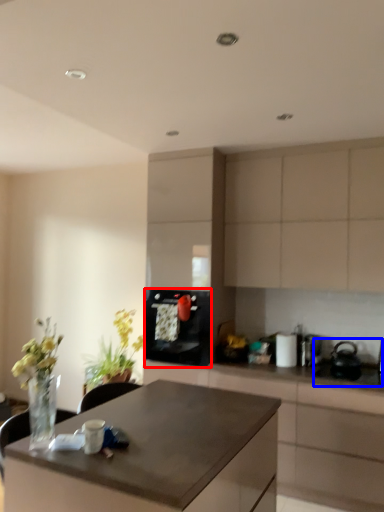
Question: Which of the following is the closest to the observer, kitchen appliance (highlighted by a red box) or sink (highlighted by a blue box)?

Choices:
 (A) kitchen appliance
 (B) sink

Answer: (B)